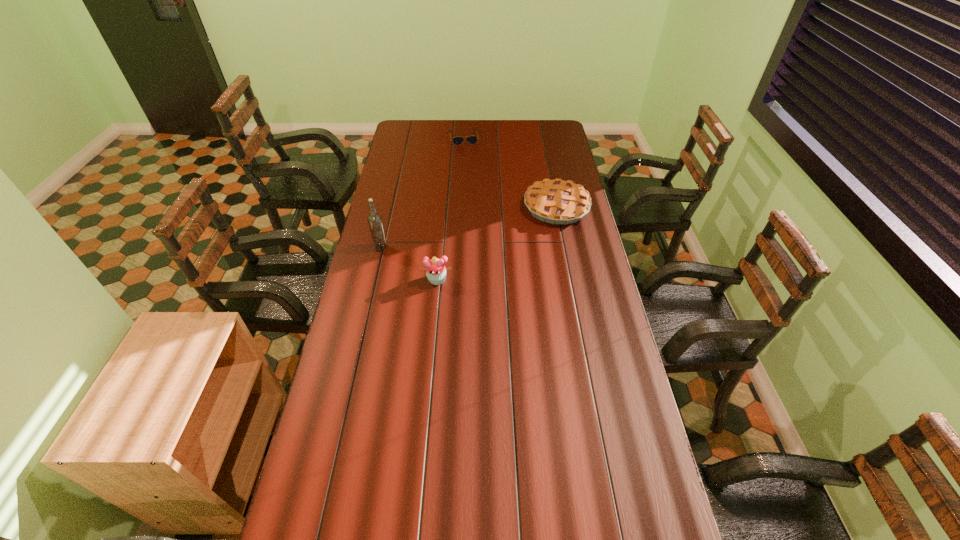
At what (x,y) coordinates should I click in order to perform the action: click on free space located on the label of the leftmost object. Please return your answer as a coordinate pair (x, y). Looking at the image, I should click on (452, 248).

The width and height of the screenshot is (960, 540). Identify the location of vacant space positioned 0.070m on the label of the leftmost object. (404, 248).

Identify the location of vacant space situated on the label of the leftmost object. (452, 248).

The height and width of the screenshot is (540, 960). In order to click on vacant area located 0.100m on the front-facing side of the shortest object in this screenshot , I will do `click(468, 156)`.

Locate an element on the screen. The height and width of the screenshot is (540, 960). blank area located 0.230m on the front-facing side of the shortest object is located at coordinates (470, 170).

This screenshot has width=960, height=540. Find the location of `vacant space situated 0.350m on the front-facing side of the shortest object`. vacant space situated 0.350m on the front-facing side of the shortest object is located at coordinates (473, 184).

Find the location of a particular element. The width and height of the screenshot is (960, 540). object that is positioned at the far edge is located at coordinates (472, 140).

Locate an element on the screen. This screenshot has width=960, height=540. object that is at the left edge is located at coordinates (374, 219).

At what (x,y) coordinates should I click in order to perform the action: click on object that is at the right edge. Please return your answer as a coordinate pair (x, y). Looking at the image, I should click on (556, 201).

Find the location of `vacant space at the near edge of the desktop`. vacant space at the near edge of the desktop is located at coordinates (494, 488).